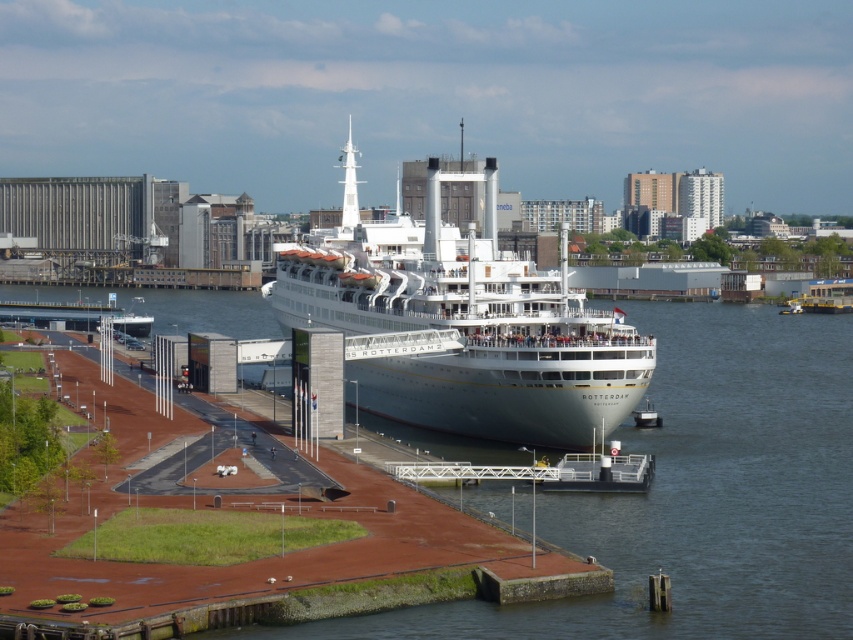
Question: Does clear water at center come in front of white glossy cruise ship at center?

Choices:
 (A) no
 (B) yes

Answer: (B)

Question: Is white glossy cruise ship at center closer to camera compared to white glossy boat at lower left?

Choices:
 (A) yes
 (B) no

Answer: (A)

Question: Which of the following is the closest to the observer?

Choices:
 (A) (114, 310)
 (B) (747, 506)
 (C) (602, 413)

Answer: (B)

Question: Which point is closer to the camera taking this photo?

Choices:
 (A) (685, 378)
 (B) (142, 298)

Answer: (A)

Question: Is white glossy cruise ship at center above white glossy boat at lower left?

Choices:
 (A) no
 (B) yes

Answer: (B)

Question: Considering the real-world distances, which object is closest to the clear water at center?

Choices:
 (A) white glossy cruise ship at center
 (B) white glossy boat at lower left

Answer: (A)